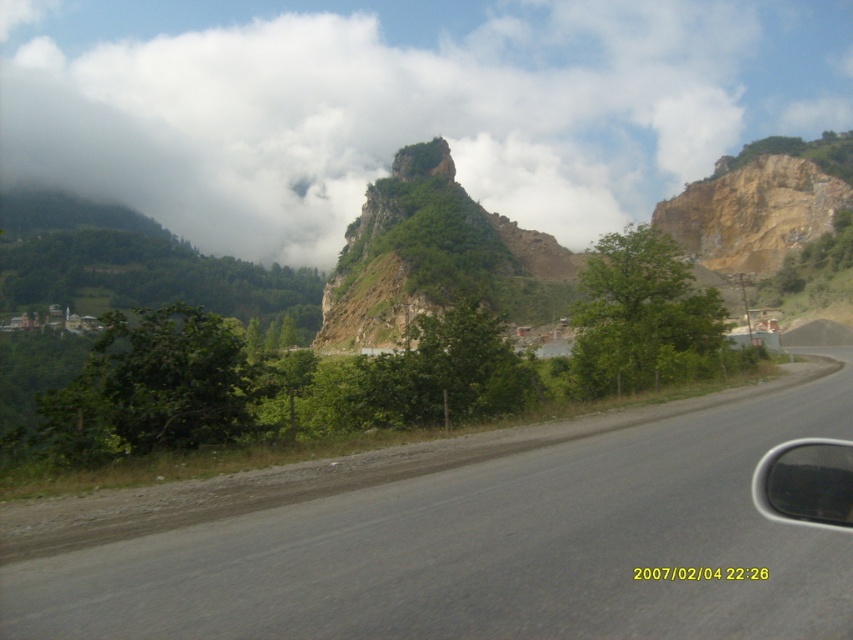
Question: Considering the relative positions of white fluffy cloud at upper center and gray asphalt road at center in the image provided, where is white fluffy cloud at upper center located with respect to gray asphalt road at center?

Choices:
 (A) below
 (B) above

Answer: (B)

Question: Estimate the real-world distances between objects in this image. Which object is farther from the white fluffy cloud at upper center?

Choices:
 (A) transparent glass car window at right
 (B) gray asphalt road at center

Answer: (A)

Question: Is white fluffy cloud at upper center to the left of transparent glass car window at right from the viewer's perspective?

Choices:
 (A) no
 (B) yes

Answer: (B)

Question: Which object is closer to the camera taking this photo?

Choices:
 (A) white fluffy cloud at upper center
 (B) transparent glass car window at right
 (C) gray asphalt road at center

Answer: (B)

Question: Does gray asphalt road at center come behind transparent glass car window at right?

Choices:
 (A) yes
 (B) no

Answer: (A)

Question: Which point is farther to the camera?

Choices:
 (A) (792, 500)
 (B) (556, 577)
 (C) (102, 166)

Answer: (C)